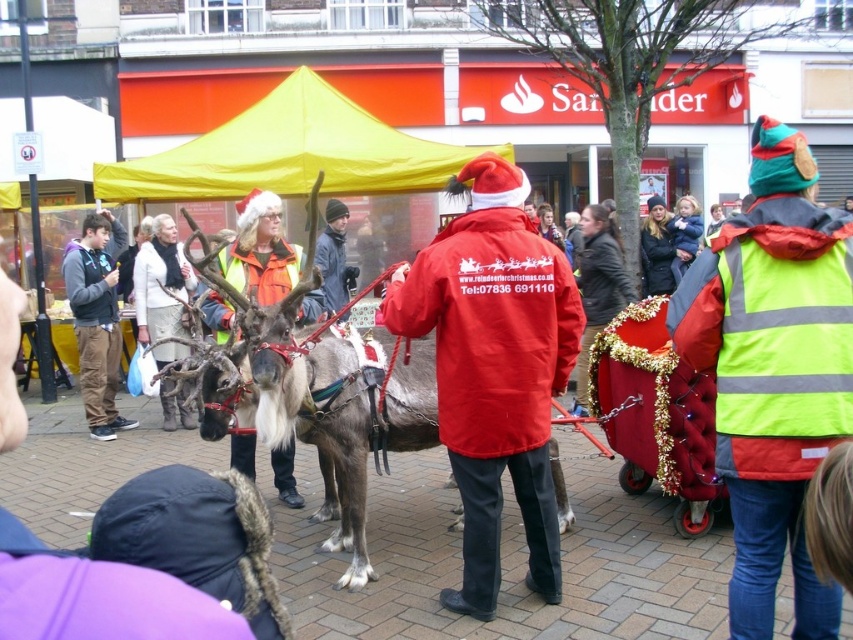
Question: Which of the following is the closest to the observer?

Choices:
 (A) (480, 417)
 (B) (300, 129)
 (C) (341, 284)

Answer: (A)

Question: Estimate the real-world distances between objects in this image. Which object is farther from the red matte coat at center?

Choices:
 (A) dark gray jacket at center
 (B) dark gray fleece jacket at left
 (C) brown fur reindeer at center
 (D) yellow fabric canopy at upper center

Answer: (D)

Question: Can you confirm if red matte coat at center is thinner than dark gray fleece jacket at left?

Choices:
 (A) yes
 (B) no

Answer: (B)

Question: Which object is the closest to the dark gray fleece jacket at left?

Choices:
 (A) red matte coat at center
 (B) dark gray jacket at center

Answer: (B)

Question: Does brown fur reindeer at center have a larger size compared to dark gray fleece jacket at left?

Choices:
 (A) no
 (B) yes

Answer: (B)

Question: Is yellow fabric canopy at upper center above dark gray jacket at center?

Choices:
 (A) no
 (B) yes

Answer: (B)